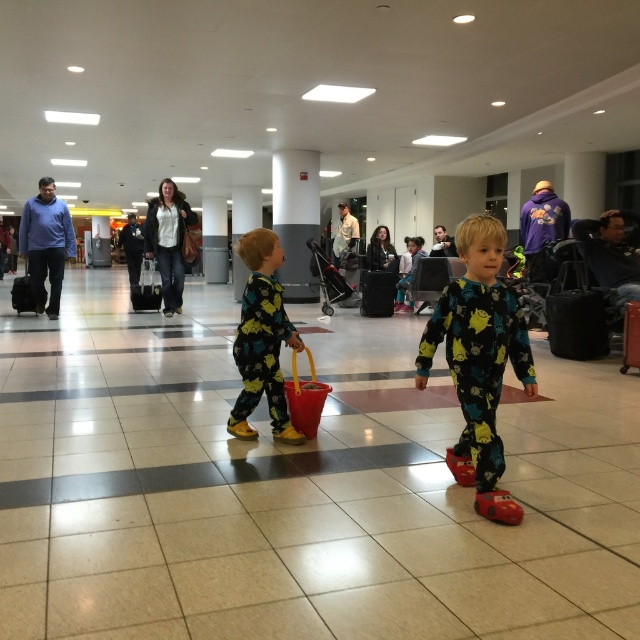
Question: Among these objects, which one is nearest to the camera?

Choices:
 (A) black hardshell suitcase at left
 (B) black fabric suitcase at right
 (C) black matte suitcase at center
 (D) matte black suitcase at center

Answer: (B)

Question: Can you confirm if printed fabric pajamas at center is positioned to the right of black fabric suitcase at right?

Choices:
 (A) no
 (B) yes

Answer: (A)

Question: Which object is farther from the camera taking this photo?

Choices:
 (A) matte black suitcase at center
 (B) black matte suitcase at center

Answer: (B)

Question: Does printed fabric pajamas at center have a greater width compared to black fabric suitcase at right?

Choices:
 (A) yes
 (B) no

Answer: (A)

Question: Is matte black suitcase at center to the left of black hardshell suitcase at left from the viewer's perspective?

Choices:
 (A) yes
 (B) no

Answer: (B)

Question: Which of the following is the closest to the observer?

Choices:
 (A) black hardshell suitcase at left
 (B) matte black suitcase at center
 (C) black matte suitcase at center
 (D) yellow matte pajamas at center

Answer: (D)